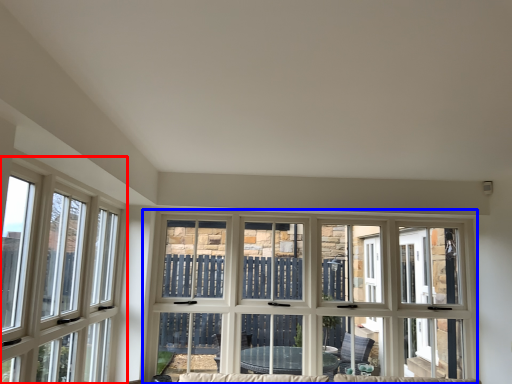
Question: Which point is closer to the camera, window (highlighted by a red box) or window (highlighted by a blue box)?

Choices:
 (A) window
 (B) window

Answer: (A)